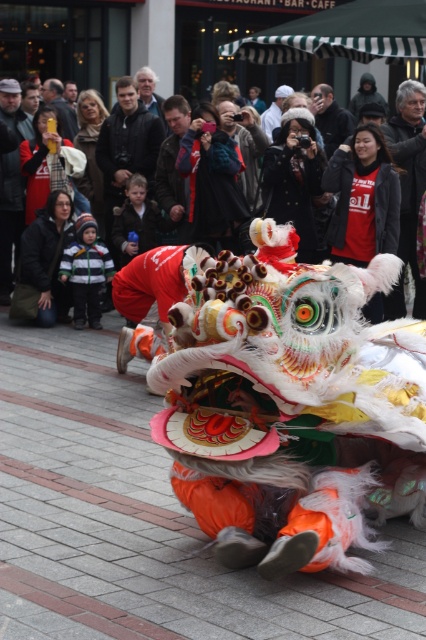
You are a photographer trying to capture the lion dance performance. You have a matte black camera at upper center. Where exactly should you position your camera to frame the lion dance performance optimally?

The matte black camera at upper center is already positioned at point (330, 116), which is the optimal location to frame the lion dance performance.

You are standing at the origin point of the coordinate system in the image. The origin is at the bottom left corner of the image. The x and y axes are normalized between 0 and 1. You want to find the matte black jacket at upper center. In which direction should you look?

The matte black jacket at upper center is located at coordinate point 0.264 on the x axis and 0.040 on the y axis. Since the origin is at the bottom left corner, the positive x direction is to the right and the positive y direction is upward. To reach the coordinates of the matte black jacket at upper center, you need to move 0.264 units to the right and 0.040 units upward from the origin. Therefore, you should look towards the upper right direction from the origin to find the matte black jacket at upper c